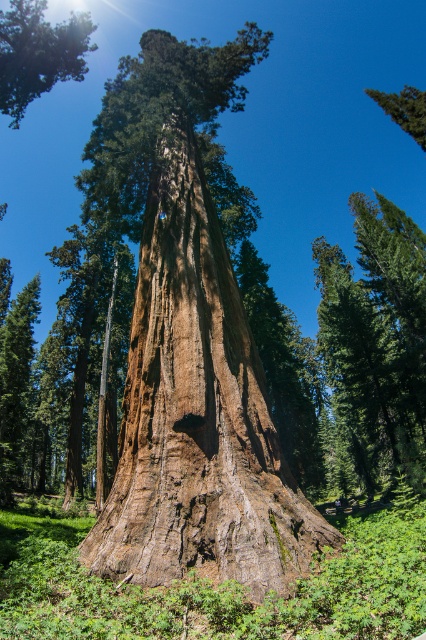
Question: Which of the following is the farthest from the observer?

Choices:
 (A) (52, 26)
 (B) (399, 120)
 (C) (233, 529)

Answer: (A)

Question: Is brown rough bark tree trunk at center bigger than smooth brown tree trunk at upper left?

Choices:
 (A) no
 (B) yes

Answer: (B)

Question: Is smooth brown tree trunk at upper left thinner than green rough bark tree at upper right?

Choices:
 (A) yes
 (B) no

Answer: (A)

Question: Where is brown rough bark tree trunk at center located in relation to smooth brown tree trunk at upper left in the image?

Choices:
 (A) below
 (B) above

Answer: (A)

Question: Which point is farther to the camera?

Choices:
 (A) [x=169, y=451]
 (B) [x=403, y=106]
 (C) [x=16, y=44]

Answer: (B)

Question: Which point appears closest to the camera in this image?

Choices:
 (A) (423, 106)
 (B) (40, 36)

Answer: (B)